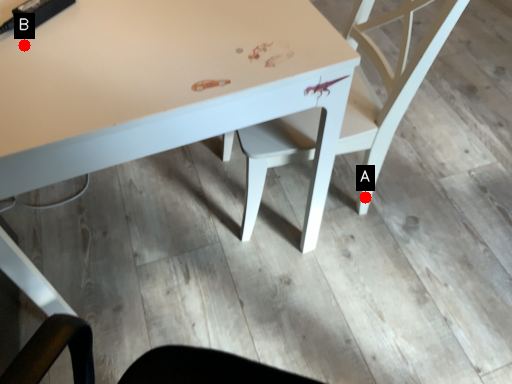
Question: Two points are circled on the image, labeled by A and B beside each circle. Among these points, which one is farthest from the camera?

Choices:
 (A) A is further
 (B) B is further

Answer: (A)